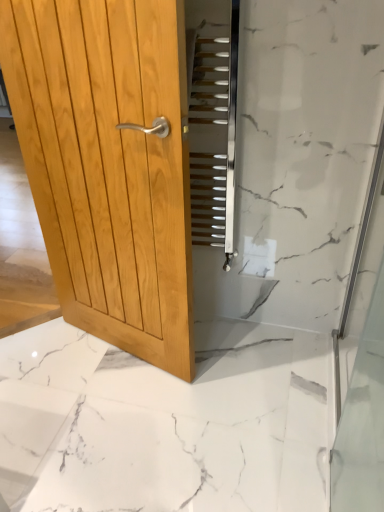
Where is `light brown wood door at left`? The height and width of the screenshot is (512, 384). light brown wood door at left is located at coordinates (109, 164).

Where is `white marble floor at center`? white marble floor at center is located at coordinates (160, 425).

This screenshot has height=512, width=384. Find the location of `light brown wood door at left`. light brown wood door at left is located at coordinates (109, 164).

From the image's perspective, is white marble floor at center over metallic silver stairs at center?

Incorrect, from the image's perspective, white marble floor at center is lower than metallic silver stairs at center.

Where is `stair behind the white marble floor at center`? The width and height of the screenshot is (384, 512). stair behind the white marble floor at center is located at coordinates (208, 136).

Is white marble floor at center wider or thinner than metallic silver stairs at center?

Clearly, white marble floor at center has more width compared to metallic silver stairs at center.

In the scene shown: Is white marble floor at center turned away from metallic silver stairs at center?

white marble floor at center is not turned away from metallic silver stairs at center.

Is point (106, 11) positioned behind point (163, 402)?

No, (106, 11) is in front of (163, 402).

Based on their sizes in the image, would you say light brown wood door at left is bigger or smaller than white marble floor at center?

Considering their sizes, light brown wood door at left takes up less space than white marble floor at center.

Is white marble floor at center at the back of light brown wood door at left?

light brown wood door at left is not turned away from white marble floor at center.

Considering the relative sizes of light brown wood door at left and white marble floor at center in the image provided, is light brown wood door at left taller than white marble floor at center?

Correct, light brown wood door at left is much taller as white marble floor at center.

Considering the sizes of objects transparent glass shower door at right and white marble floor at center in the image provided, who is shorter, transparent glass shower door at right or white marble floor at center?

white marble floor at center is shorter.

Which object is positioned more to the right, transparent glass shower door at right or white marble floor at center?

From the viewer's perspective, transparent glass shower door at right appears more on the right side.

From a real-world perspective, which is physically above, transparent glass shower door at right or white marble floor at center?

transparent glass shower door at right, from a real-world perspective.

From the image's perspective, which object appears higher, white marble floor at center or transparent glass shower door at right?

transparent glass shower door at right appears higher in the image.

Does white marble floor at center come in front of transparent glass shower door at right?

That is False.

Considering the sizes of objects white marble floor at center and transparent glass shower door at right in the image provided, who is taller, white marble floor at center or transparent glass shower door at right?

transparent glass shower door at right.

Would you say white marble floor at center contains light brown wood door at left?

Definitely not — light brown wood door at left is not inside white marble floor at center.

From a real-world perspective, is white marble floor at center above or below light brown wood door at left?

white marble floor at center is below light brown wood door at left.

The image size is (384, 512). I want to click on granite below the light brown wood door at left (from a real-world perspective), so click(x=160, y=425).

From the image's perspective, is white marble floor at center located beneath light brown wood door at left?

Yes, from the image's perspective, white marble floor at center is below light brown wood door at left.

Is the surface of transparent glass shower door at right in direct contact with metallic silver stairs at center?

No, transparent glass shower door at right is not touching metallic silver stairs at center.

Between transparent glass shower door at right and metallic silver stairs at center, which one has larger size?

With larger size is transparent glass shower door at right.

Which of these two, transparent glass shower door at right or metallic silver stairs at center, is wider?

Wider between the two is metallic silver stairs at center.

From a real-world perspective, which object stands above the other?

From a 3D spatial view, metallic silver stairs at center is above.

Is the position of metallic silver stairs at center less distant than that of transparent glass shower door at right?

No, metallic silver stairs at center is behind transparent glass shower door at right.

Does point (223, 226) lie in front of point (376, 410)?

No, (223, 226) is further to viewer.

Which of these two, metallic silver stairs at center or transparent glass shower door at right, is wider?

metallic silver stairs at center.

The width and height of the screenshot is (384, 512). Find the location of `granite beneath the metallic silver stairs at center (from a real-world perspective)`. granite beneath the metallic silver stairs at center (from a real-world perspective) is located at coordinates (160, 425).

Identify the location of granite behind the light brown wood door at left. This screenshot has width=384, height=512. (160, 425).

Looking at the image, which one is located further to transparent glass shower door at right, light brown wood door at left or white marble floor at center?

The object further to transparent glass shower door at right is light brown wood door at left.

When comparing their distances from metallic silver stairs at center, does white marble floor at center or light brown wood door at left seem closer?

light brown wood door at left lies closer to metallic silver stairs at center than the other object.

Considering their positions, is metallic silver stairs at center positioned closer to white marble floor at center than transparent glass shower door at right?

transparent glass shower door at right is positioned closer to the anchor white marble floor at center.

From the image, which object appears to be farther from metallic silver stairs at center, transparent glass shower door at right or light brown wood door at left?

Among the two, transparent glass shower door at right is located further to metallic silver stairs at center.

Which object lies nearer to the anchor point metallic silver stairs at center, white marble floor at center or transparent glass shower door at right?

transparent glass shower door at right is positioned closer to the anchor metallic silver stairs at center.

Based on their spatial positions, is transparent glass shower door at right or metallic silver stairs at center further from white marble floor at center?

metallic silver stairs at center is positioned further to the anchor white marble floor at center.

Which object lies further to the anchor point light brown wood door at left, white marble floor at center or metallic silver stairs at center?

white marble floor at center is further to light brown wood door at left.

Considering their positions, is transparent glass shower door at right positioned further to light brown wood door at left than metallic silver stairs at center?

The object further to light brown wood door at left is transparent glass shower door at right.

Locate an element on the screen. The width and height of the screenshot is (384, 512). stair between light brown wood door at left and transparent glass shower door at right from left to right is located at coordinates point(208,136).

You are a GUI agent. You are given a task and a screenshot of the screen. Output one action in this format:
    pyautogui.click(x=<x>, y=<y>)
    Task: Click on the shower door between metallic silver stairs at center and white marble floor at center in the up-down direction
    
    Given the screenshot: What is the action you would take?
    pyautogui.click(x=361, y=393)

Image resolution: width=384 pixels, height=512 pixels. I want to click on door between metallic silver stairs at center and white marble floor at center from top to bottom, so click(109, 164).

Identify the location of granite between light brown wood door at left and transparent glass shower door at right in the horizontal direction. The width and height of the screenshot is (384, 512). (160, 425).